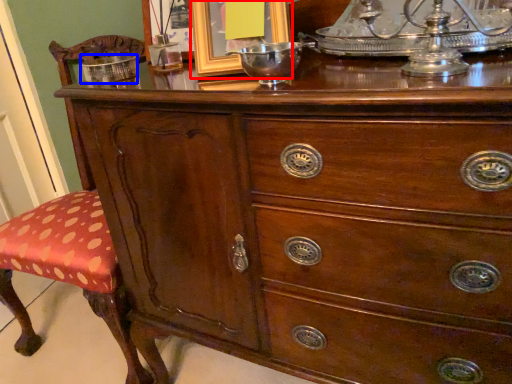
Question: Among these objects, which one is farthest to the camera, picture frame (highlighted by a red box) or bowl (highlighted by a blue box)?

Choices:
 (A) picture frame
 (B) bowl

Answer: (B)